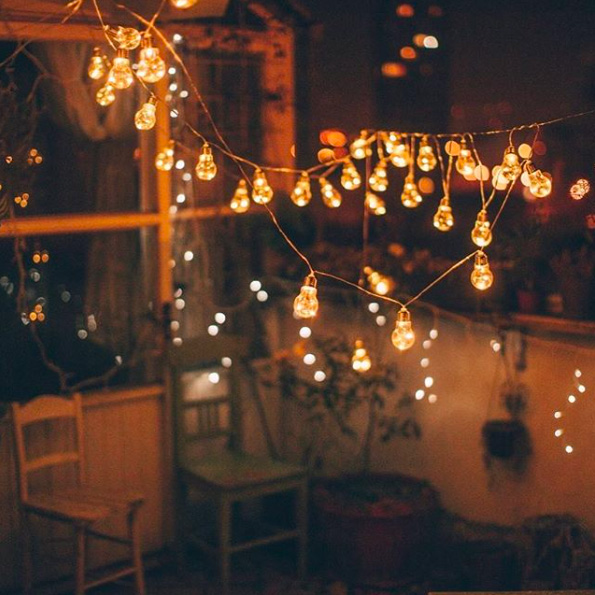
Where is `glass`? This screenshot has height=595, width=595. glass is located at coordinates (84, 305), (87, 172), (226, 111), (226, 262).